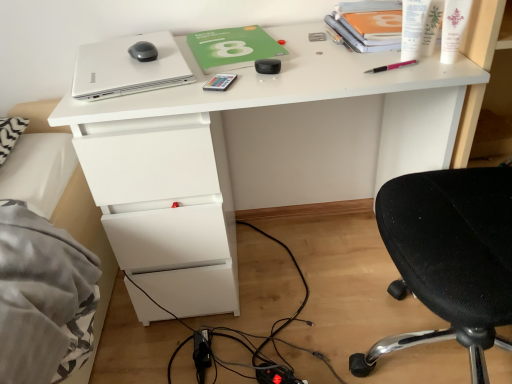
Image resolution: width=512 pixels, height=384 pixels. Find the location of `vacant space situated on the left part of white plastic pen at upper right, the 2th stationery from the right`. vacant space situated on the left part of white plastic pen at upper right, the 2th stationery from the right is located at coordinates (337, 64).